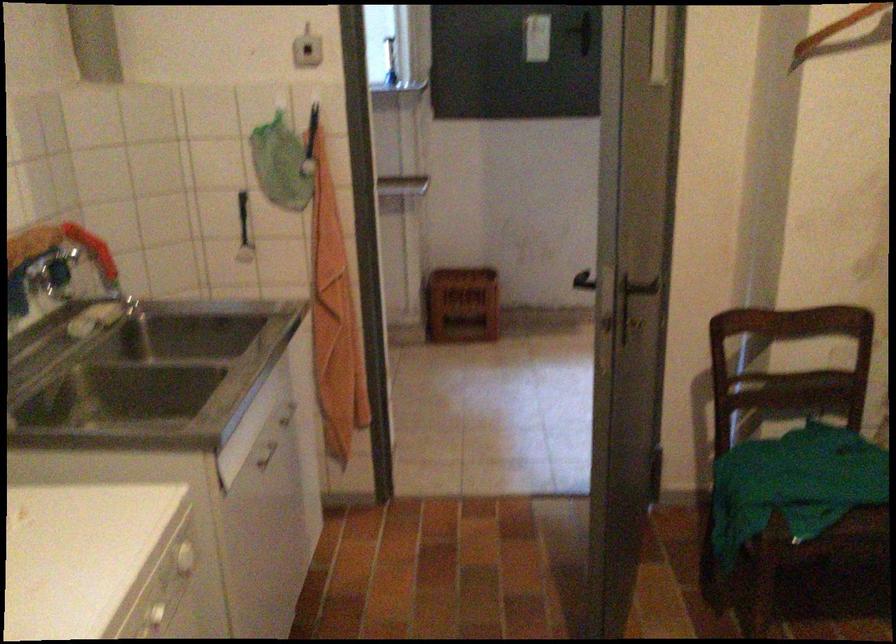
Identify the location of green net bag. This screenshot has height=644, width=896. (793, 485).